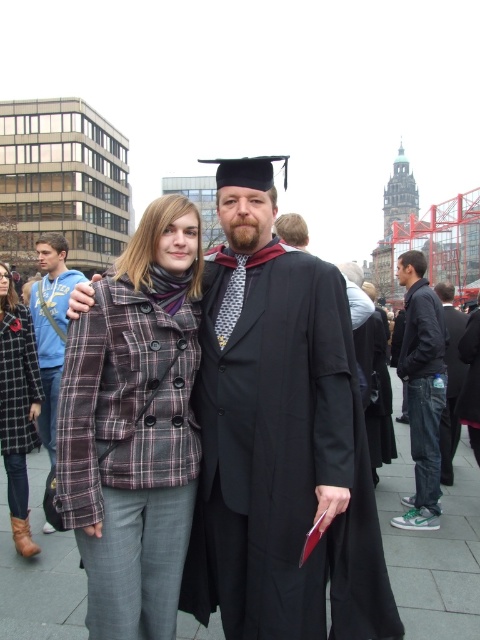
You are standing at point (456, 417) and want to walk to point (168, 621). Is the path between these two points clear of any obstacles?

The path between point (168, 621) and point (456, 417) is clear since point (168, 621) is in front of point (456, 417), indicating no obstacles are blocking the way.

You are a photographer at a graduation ceremony. You need to capture a photo of the graduate and the two people wearing plaid coats. However, you want to ensure that the person in the plaid wool coat at center is placed to the right of the plaid fabric coat at left in the final image. Based on the current arrangement, is this possible without moving anyone?

The plaid wool coat at center is already positioned on the right side of plaid fabric coat at left, so the current arrangement already meets the requirement without needing to move anyone.